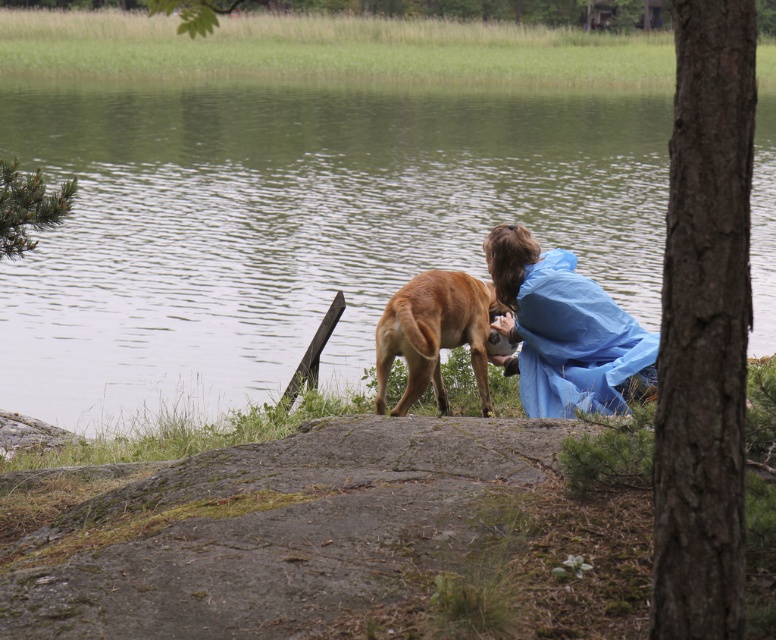
Is green water at center shorter than blue waterproof jacket at center?

No, green water at center is not shorter than blue waterproof jacket at center.

Can you confirm if green water at center is thinner than blue waterproof jacket at center?

In fact, green water at center might be wider than blue waterproof jacket at center.

Is point (663, 241) positioned before point (574, 264)?

No, it is behind (574, 264).

Locate an element on the screen. green water at center is located at coordinates (293, 225).

Between point (559, 352) and point (407, 316), which one is positioned in front?

Positioned in front is point (407, 316).

Is point (556, 321) closer to camera compared to point (469, 285)?

Yes, it is in front of point (469, 285).

This screenshot has width=776, height=640. What do you see at coordinates (565, 332) in the screenshot?
I see `blue waterproof jacket at center` at bounding box center [565, 332].

This screenshot has height=640, width=776. Identify the location of blue waterproof jacket at center. (565, 332).

Between green water at center and brown furry dog at center, which one is positioned lower?

brown furry dog at center

Describe the element at coordinates (293, 225) in the screenshot. This screenshot has height=640, width=776. I see `green water at center` at that location.

Find the location of a particular element. The height and width of the screenshot is (640, 776). green water at center is located at coordinates (293, 225).